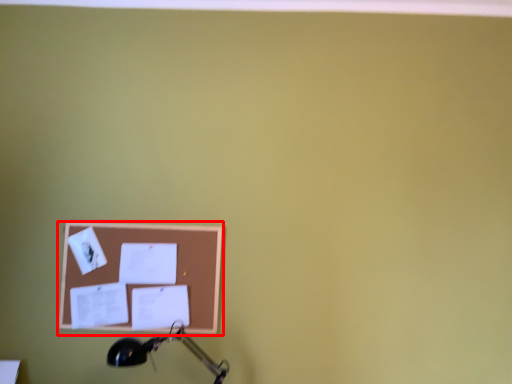
Question: From the image's perspective, considering the relative positions of picture frame (annotated by the red box) and table lamp in the image provided, where is picture frame (annotated by the red box) located with respect to the staircase?

Choices:
 (A) below
 (B) above

Answer: (B)